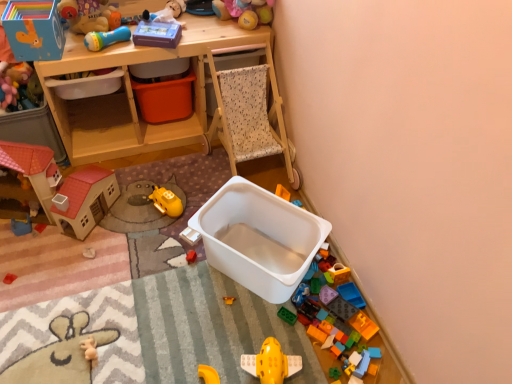
Question: Do you think yellow plastic airplane at center, arranged as the tenth toy when viewed from the top, is within translucent plastic blocks at lower right, which is counted as the eighth toy, starting from the top, or outside of it?

Choices:
 (A) inside
 (B) outside

Answer: (B)

Question: In terms of width, does yellow plastic airplane at center, the 7th toy in the left-to-right sequence, look wider or thinner when compared to translucent plastic blocks at lower right, acting as the tenth toy starting from the left?

Choices:
 (A) wide
 (B) thin

Answer: (A)

Question: Which object is the farthest from the blue plastic toy at left, arranged as the 6th toy when ordered from the bottom?

Choices:
 (A) white plastic container at center-left, marked as the second storage box in a left-to-right arrangement
 (B) rubber duck at lower left, the 9th toy in the top-to-bottom sequence
 (C) translucent plastic blocks at lower right, the third toy ordered from the bottom
 (D) yellow plastic airplane at center, the 7th toy in the left-to-right sequence
 (E) soft plush toy at upper center, which appears as the 1th toy when viewed from the top

Answer: (C)

Question: Estimate the real-world distances between objects in this image. Which object is closer to the translucent plastic blocks at lower right, acting as the tenth toy starting from the left?

Choices:
 (A) blue plastic toy at left, which appears as the fifth toy when viewed from the top
 (B) white plastic container at center-left, marked as the second storage box in a left-to-right arrangement
 (C) matte plastic playhouse at left, marked as the 2th toy in a left-to-right arrangement
 (D) matte cardboard box at upper left, which is counted as the eighth toy, starting from the bottom
 (E) rubber duck at lower left, arranged as the second toy when ordered from the bottom

Answer: (E)